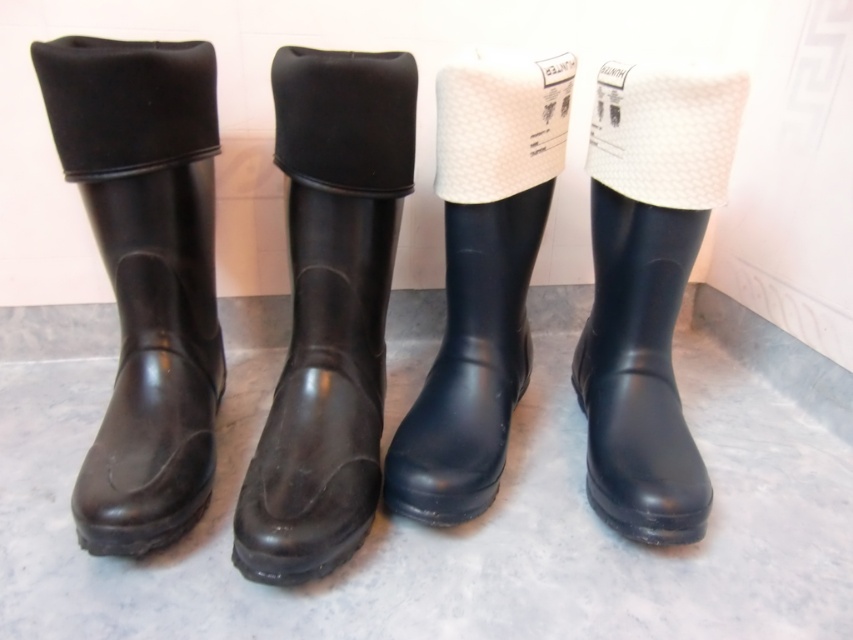
Question: Can you confirm if black rubber boot at left is positioned to the right of black rubber boot at right?

Choices:
 (A) yes
 (B) no

Answer: (B)

Question: Estimate the real-world distances between objects in this image. Which object is closer to the black rubber boot at right?

Choices:
 (A) black rubber boot at left
 (B) black rubber boot at center

Answer: (B)

Question: Considering the relative positions of black rubber boot at center and black rubber boot at right in the image provided, where is black rubber boot at center located with respect to black rubber boot at right?

Choices:
 (A) right
 (B) left

Answer: (B)

Question: Which of the following is the farthest from the observer?

Choices:
 (A) black rubber boot at left
 (B) navy rubber boot at center
 (C) black rubber boot at center

Answer: (B)

Question: Estimate the real-world distances between objects in this image. Which object is farther from the black rubber boot at right?

Choices:
 (A) navy rubber boot at center
 (B) black rubber boot at left
 (C) black rubber boot at center

Answer: (B)

Question: Is black rubber boot at left bigger than black rubber boot at center?

Choices:
 (A) yes
 (B) no

Answer: (B)